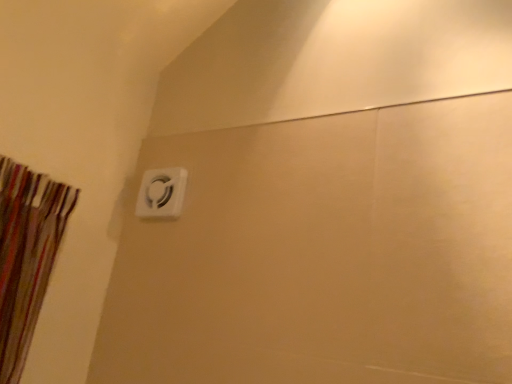
You are a GUI agent. You are given a task and a screenshot of the screen. Output one action in this format:
    pyautogui.click(x=<x>, y=<y>)
    Task: Click on the white plastic light switch at center
    
    Given the screenshot: What is the action you would take?
    pyautogui.click(x=161, y=193)

This screenshot has height=384, width=512. What do you see at coordinates (161, 193) in the screenshot?
I see `white plastic light switch at center` at bounding box center [161, 193].

In order to face white plastic light switch at center, should I rotate leftwards or rightwards?

Rotate left and turn 12.777 degrees.

The width and height of the screenshot is (512, 384). In order to click on white plastic light switch at center in this screenshot , I will do `click(161, 193)`.